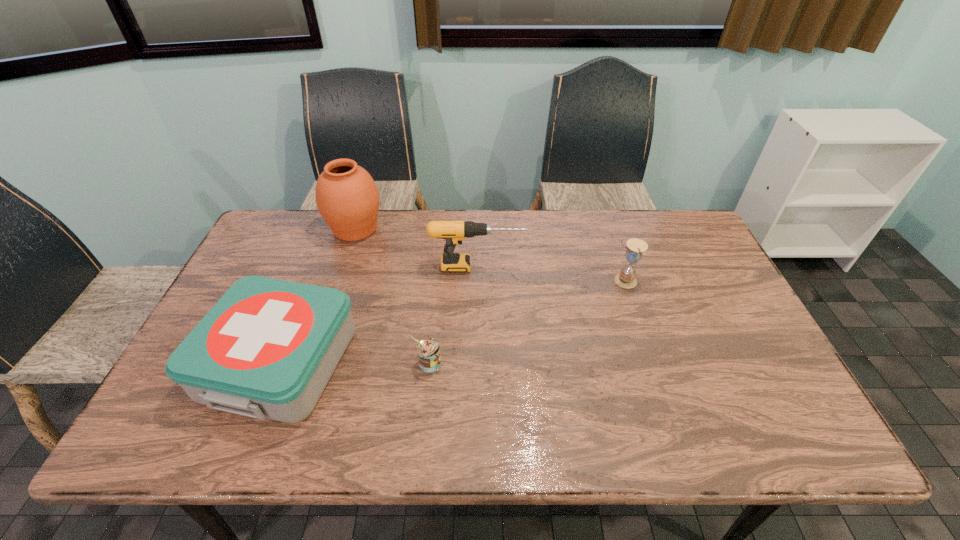
The height and width of the screenshot is (540, 960). Identify the location of unoccupied position between the second shortest object and the rightmost object. (452, 321).

Locate an element on the screen. object that stands as the second closest to the drill is located at coordinates (267, 349).

Identify which object is located as the second nearest to the can. Please provide its 2D coordinates. Your answer should be formatted as a tuple, i.e. [(x, y)], where the tuple contains the x and y coordinates of a point satisfying the conditions above.

[(454, 232)]

Identify the location of vacant region that satisfies the following two spatial constraints: 1. on the handle side of the drill; 2. on the back side of the rightmost object. (477, 281).

Locate an element on the screen. The image size is (960, 540). vacant region that satisfies the following two spatial constraints: 1. on the handle side of the drill; 2. on the back side of the hourglass is located at coordinates (477, 281).

Find the location of a particular element. The image size is (960, 540). blank space that satisfies the following two spatial constraints: 1. on the handle side of the drill; 2. on the left side of the rightmost object is located at coordinates (477, 281).

Locate an element on the screen. vacant space that satisfies the following two spatial constraints: 1. on the handle side of the drill; 2. on the front side of the first-aid kit is located at coordinates (476, 362).